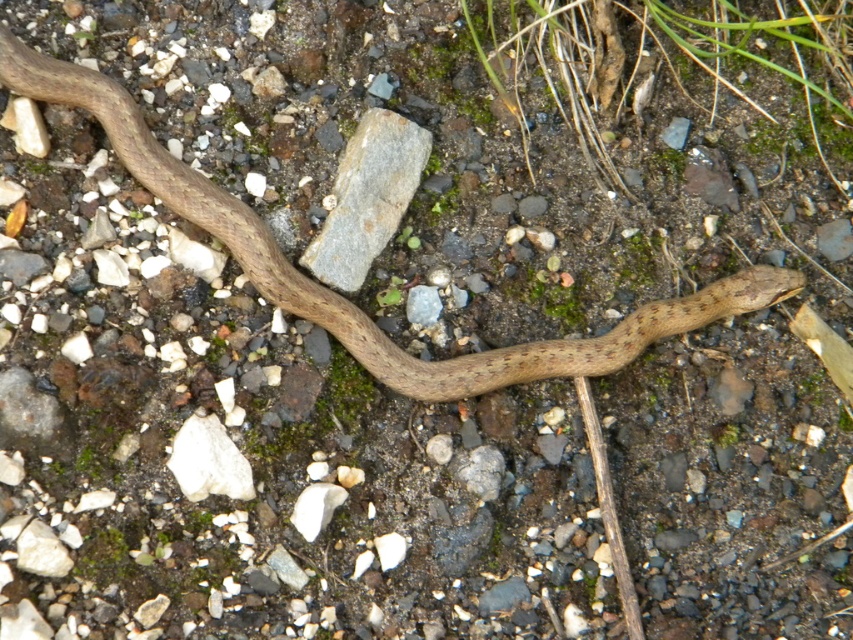
Is point (354, 272) closer to viewer compared to point (195, 483)?

No, (354, 272) is further to viewer.

Does gray rock at center appear over white matte rock at lower left?

Yes, gray rock at center is above white matte rock at lower left.

Locate an element on the screen. This screenshot has width=853, height=640. gray rock at center is located at coordinates (367, 196).

Which is behind, point (643, 323) or point (397, 200)?

Point (397, 200)

Can you confirm if brown matte snake at center is positioned to the left of gray rock at center?

In fact, brown matte snake at center is to the right of gray rock at center.

Is point (544, 342) less distant than point (337, 253)?

That is False.

Locate an element on the screen. Image resolution: width=853 pixels, height=640 pixels. brown matte snake at center is located at coordinates (341, 296).

Between point (439, 401) and point (177, 474), which one is positioned behind?

The point (439, 401) is behind.

The height and width of the screenshot is (640, 853). Describe the element at coordinates (341, 296) in the screenshot. I see `brown matte snake at center` at that location.

The width and height of the screenshot is (853, 640). Identify the location of brown matte snake at center. (341, 296).